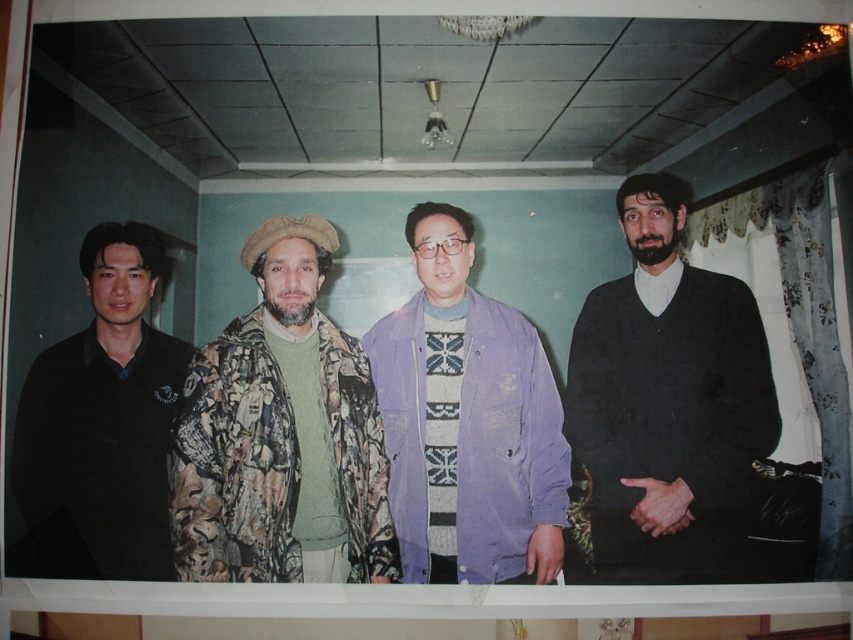
Does purple corduroy jacket at center come behind black matte shirt at left?

That is True.

What do you see at coordinates (467, 420) in the screenshot?
I see `purple corduroy jacket at center` at bounding box center [467, 420].

Locate an element on the screen. This screenshot has height=640, width=853. purple corduroy jacket at center is located at coordinates (467, 420).

Does camouflage jacket at center have a smaller size compared to purple corduroy jacket at center?

Incorrect, camouflage jacket at center is not smaller in size than purple corduroy jacket at center.

Locate an element on the screen. camouflage jacket at center is located at coordinates (281, 435).

Between point (310, 577) and point (96, 365), which one is positioned in front?

Point (310, 577) is more forward.

Who is positioned more to the left, camouflage jacket at center or black matte shirt at left?

Positioned to the left is black matte shirt at left.

Find the location of a particular element. Image resolution: width=853 pixels, height=640 pixels. camouflage jacket at center is located at coordinates (281, 435).

Where is `camouflage jacket at center`? The width and height of the screenshot is (853, 640). camouflage jacket at center is located at coordinates (281, 435).